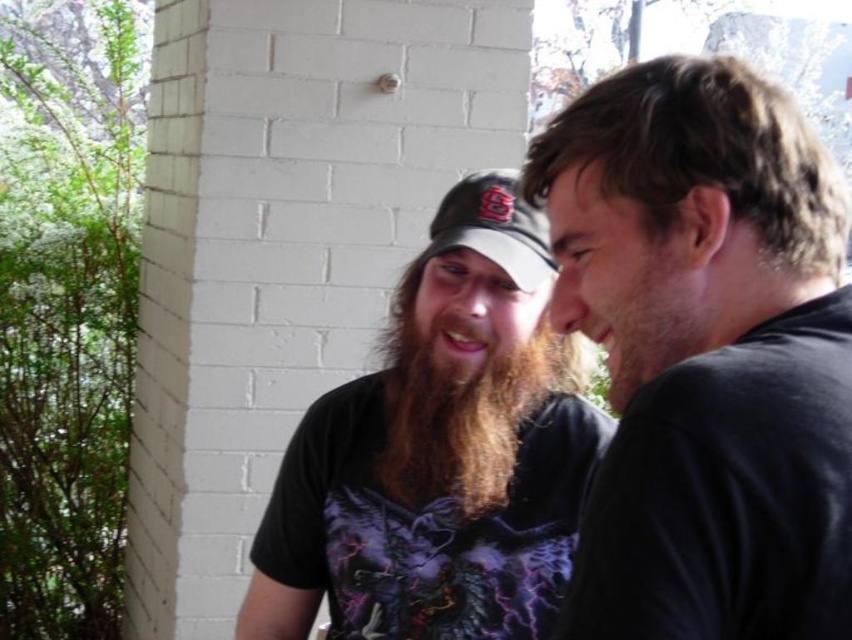
Question: Can you confirm if curly brown hair at right is thinner than matte baseball cap at center?

Choices:
 (A) yes
 (B) no

Answer: (B)

Question: Which object is closer to the camera taking this photo?

Choices:
 (A) brown hair at center
 (B) matte baseball cap at center
 (C) brown fuzzy beard at center

Answer: (A)

Question: In this image, where is brown fuzzy beard at center located relative to matte baseball cap at center?

Choices:
 (A) below
 (B) above

Answer: (A)

Question: Which object is positioned farthest from the dark brown hair at upper right?

Choices:
 (A) brown matte beard at right
 (B) brown fuzzy beard at center

Answer: (B)

Question: In this image, where is dark brown hair at upper right located relative to brown hair at center?

Choices:
 (A) right
 (B) left

Answer: (A)

Question: Considering the real-world distances, which object is closest to the matte baseball cap at center?

Choices:
 (A) dark brown hair at upper right
 (B) curly brown hair at right
 (C) brown matte beard at right

Answer: (B)